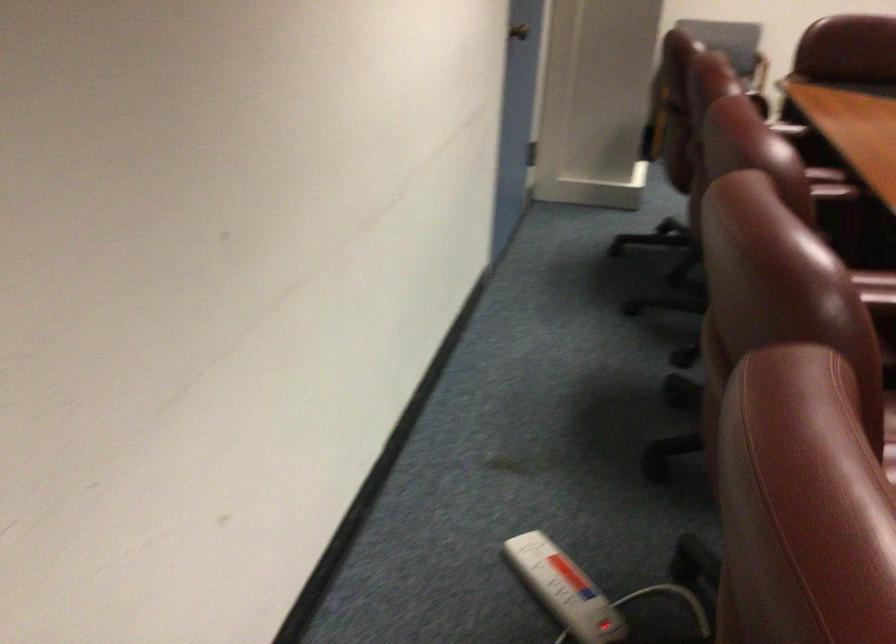
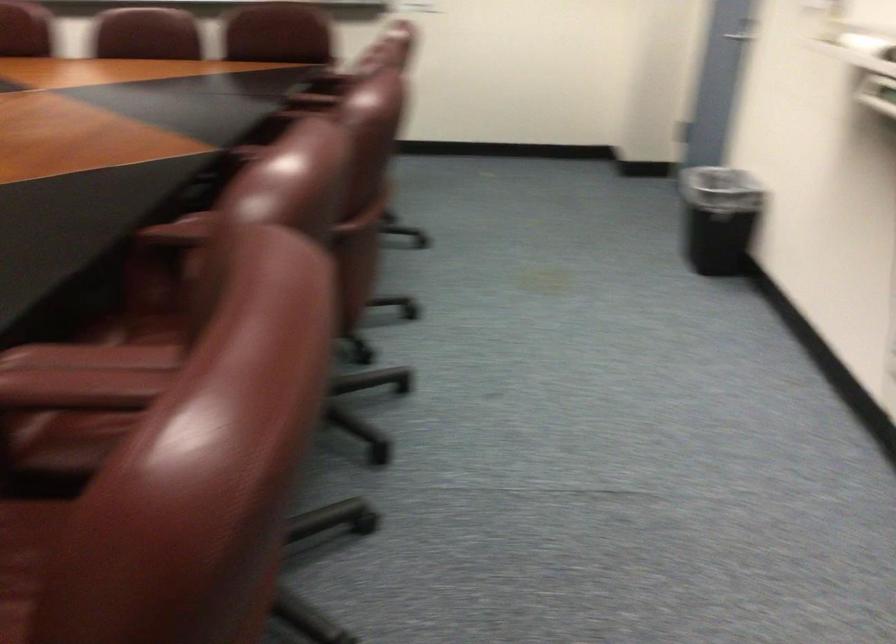
Question: Which direction would the cameraman need to move to produce the second image? Reply with the corresponding letter.

Choices:
 (A) Left
 (B) Right
 (C) Forward
 (D) Backward

Answer: (D)